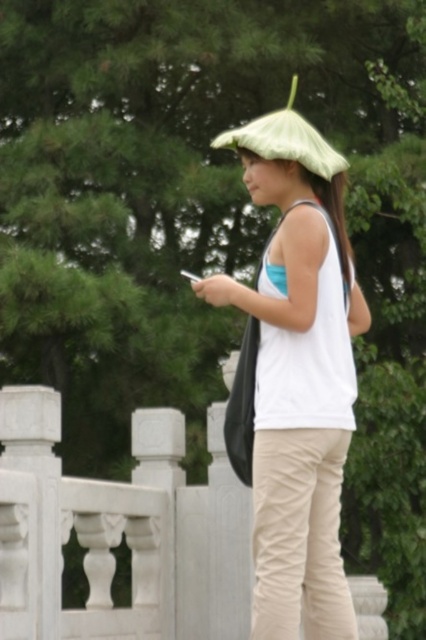
Question: Which point appears farthest from the camera in this image?

Choices:
 (A) (261, 435)
 (B) (57, 616)
 (C) (222, 140)
 (D) (330, 500)

Answer: (B)

Question: Does white stone fence at center appear on the left side of matte khaki pants at lower center?

Choices:
 (A) no
 (B) yes

Answer: (B)

Question: Is white stone fence at center behind green fabric umbrella at upper center?

Choices:
 (A) yes
 (B) no

Answer: (A)

Question: Is the position of white stone fence at center less distant than that of green fabric umbrella at upper center?

Choices:
 (A) yes
 (B) no

Answer: (B)

Question: Which point is farther from the camera taking this photo?

Choices:
 (A) [319, 513]
 (B) [268, 564]
 (C) [296, 81]
 (D) [54, 403]

Answer: (C)

Question: Which object appears farthest from the camera in this image?

Choices:
 (A) matte khaki pants at lower center
 (B) white stone fence at center
 (C) green fabric umbrella at upper center
 (D) matte green umbrella at center

Answer: (B)